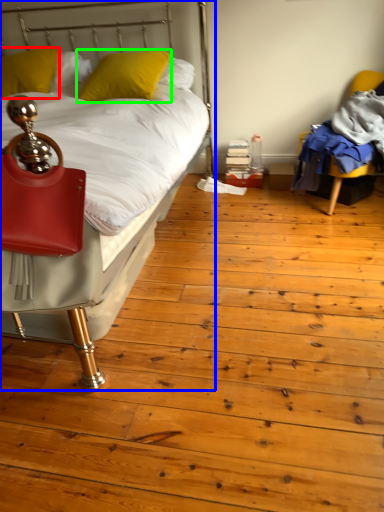
Question: Based on their relative distances, which object is farther from pillow (highlighted by a red box)? Choose from bed (highlighted by a blue box) and pillow (highlighted by a green box).

Choices:
 (A) bed
 (B) pillow

Answer: (A)